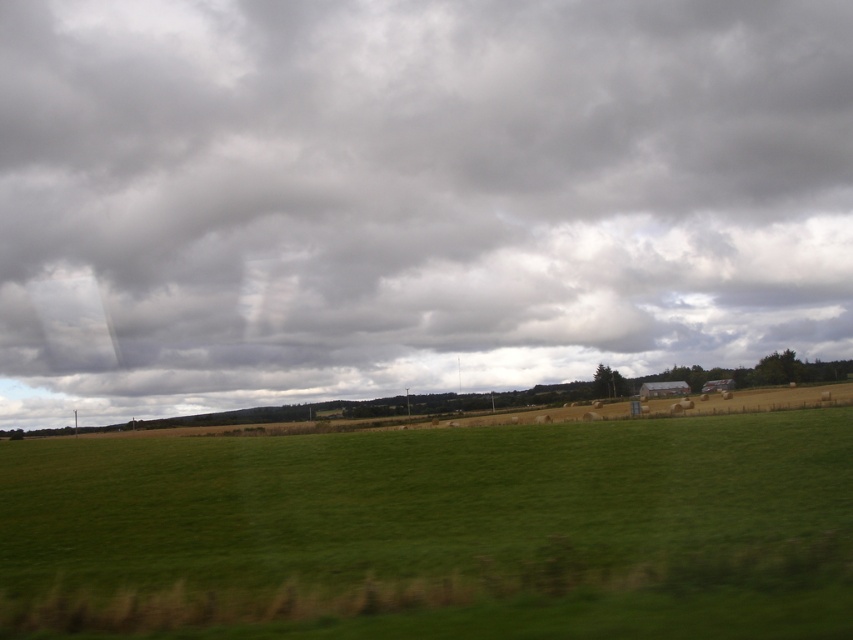
Question: Is gray cloudy sky at upper center to the right of green grassy field at center from the viewer's perspective?

Choices:
 (A) no
 (B) yes

Answer: (A)

Question: Which point is closer to the camera?

Choices:
 (A) (148, 134)
 (B) (712, 609)

Answer: (B)

Question: Which point is farther from the camera taking this photo?

Choices:
 (A) (498, 513)
 (B) (756, 112)

Answer: (B)

Question: Can you confirm if gray cloudy sky at upper center is positioned above green grassy field at center?

Choices:
 (A) yes
 (B) no

Answer: (A)

Question: Is gray cloudy sky at upper center further to camera compared to green grassy field at center?

Choices:
 (A) yes
 (B) no

Answer: (A)

Question: Among these points, which one is farthest from the camera?

Choices:
 (A) (x=471, y=198)
 (B) (x=757, y=522)

Answer: (A)